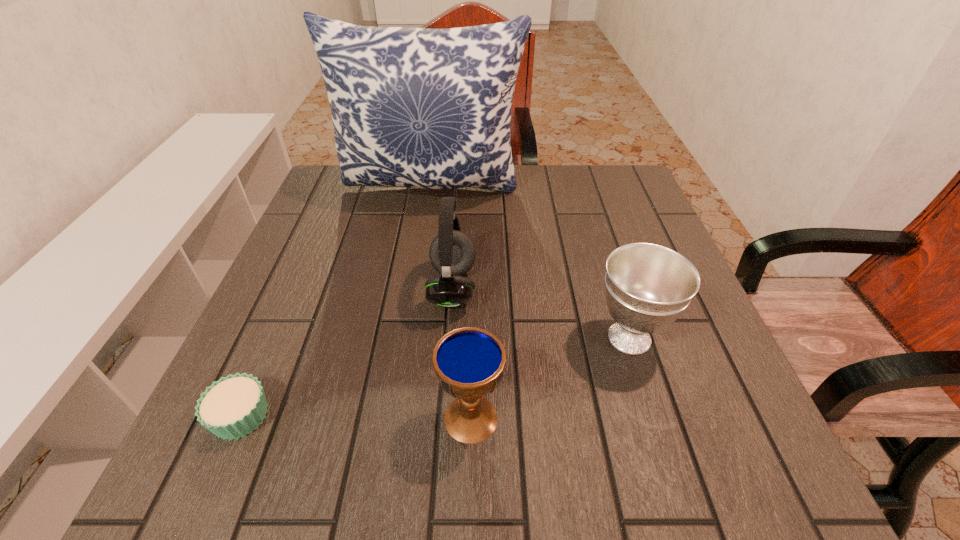
The image size is (960, 540). Identify the location of free space between the nearer chalice and the farther chalice. (550, 378).

Locate an element on the screen. free space that is in between the right chalice and the nearer chalice is located at coordinates (550, 378).

At what (x,y) coordinates should I click in order to perform the action: click on free space between the rightmost object and the left chalice. Please return your answer as a coordinate pair (x, y). Looking at the image, I should click on (550, 378).

Point out which object is positioned as the third nearest to the fourth shortest object. Please provide its 2D coordinates. Your answer should be formatted as a tuple, i.e. [(x, y)], where the tuple contains the x and y coordinates of a point satisfying the conditions above.

[(647, 286)]

I want to click on the second closest object to the farther chalice, so click(x=452, y=253).

Where is `free region that satisfies the following two spatial constraints: 1. on the ear cups of the fourth shortest object; 2. on the back side of the nearer chalice`? free region that satisfies the following two spatial constraints: 1. on the ear cups of the fourth shortest object; 2. on the back side of the nearer chalice is located at coordinates (444, 418).

Find the location of a particular element. Image resolution: width=960 pixels, height=540 pixels. free location that satisfies the following two spatial constraints: 1. on the ear cups of the nearer chalice; 2. on the right side of the second tallest object is located at coordinates (444, 418).

Where is `vacant space that satisfies the following two spatial constraints: 1. on the ear cups of the fourth shortest object; 2. on the front side of the shortest object`? vacant space that satisfies the following two spatial constraints: 1. on the ear cups of the fourth shortest object; 2. on the front side of the shortest object is located at coordinates (444, 416).